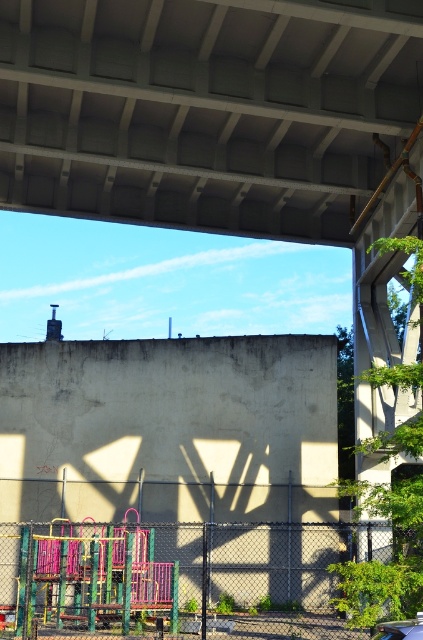
Question: Can you confirm if concrete at center is smaller than green chain-link fence at lower center?

Choices:
 (A) no
 (B) yes

Answer: (B)

Question: Which of the following is the farthest from the observer?

Choices:
 (A) (115, 390)
 (B) (164, 212)

Answer: (A)

Question: Which of the following is the closest to the observer?

Choices:
 (A) green chain-link fence at lower center
 (B) shiny black car at lower right
 (C) metallic playground equipment at lower left

Answer: (B)

Question: Which of the following is the closest to the observer?

Choices:
 (A) shiny black car at lower right
 (B) concrete at center
 (C) metallic playground equipment at lower left

Answer: (A)

Question: From the image, what is the correct spatial relationship of green chain-link fence at lower center in relation to shiny black car at lower right?

Choices:
 (A) below
 (B) above

Answer: (A)

Question: Is metallic playground equipment at lower left smaller than green chain-link fence at lower center?

Choices:
 (A) no
 (B) yes

Answer: (B)